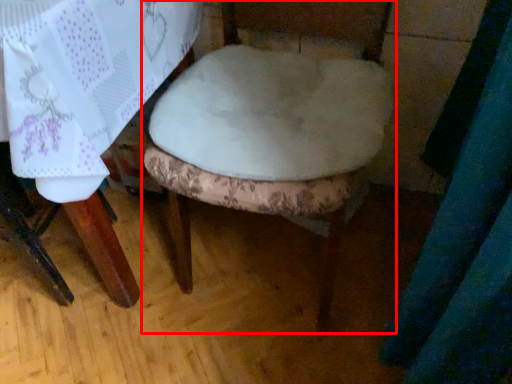
Question: In this image, where is chair (annotated by the red box) located relative to round table?

Choices:
 (A) right
 (B) left

Answer: (A)